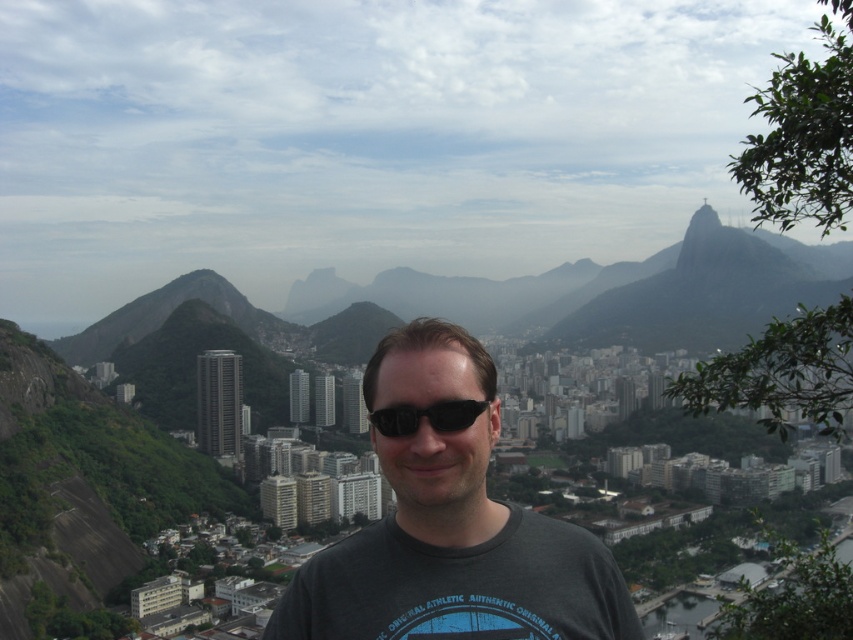
You are standing at the point marked by the coordinates point (450,529) in the image. What object is located exactly at this point?

The point (450,529) marks the dark gray t shirt at center.